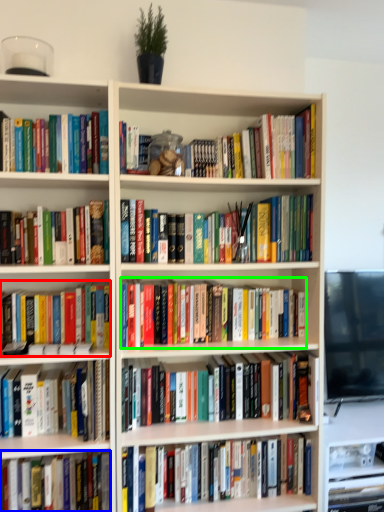
Question: Based on their relative distances, which object is nearer to book (highlighted by a red box)? Choose from book (highlighted by a blue box) and book (highlighted by a green box).

Choices:
 (A) book
 (B) book

Answer: (B)